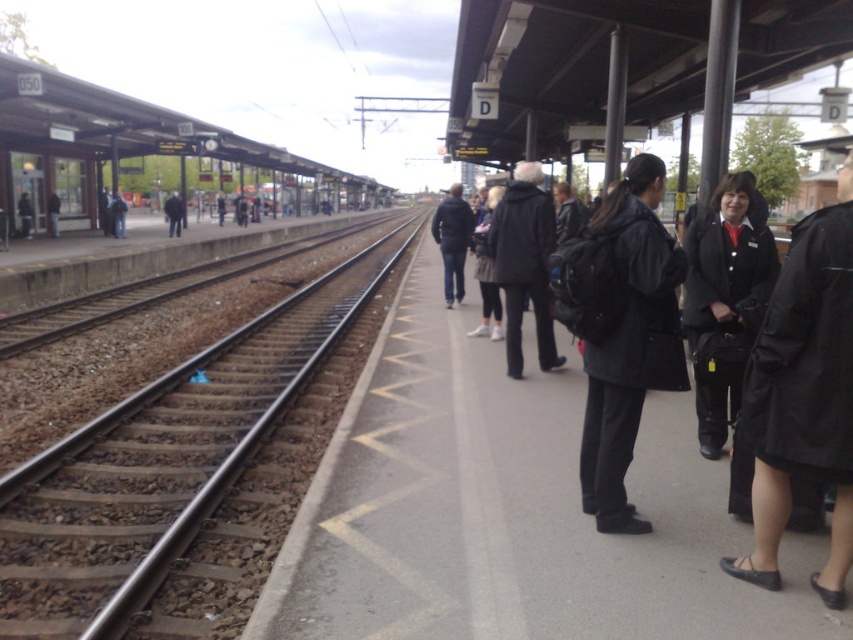
Question: Observing the image, what is the correct spatial positioning of black matte coat at right in reference to dark gray coat at center?

Choices:
 (A) above
 (B) below

Answer: (B)

Question: Which is nearer to the black matte coat at right?

Choices:
 (A) smooth steel tracks at center
 (B) matte black backpack at center
 (C) dark gray coat at center

Answer: (B)

Question: Which point is farther to the camera?

Choices:
 (A) black matte coat at right
 (B) dark gray coat at center
 (C) matte black backpack at center

Answer: (B)

Question: Estimate the real-world distances between objects in this image. Which object is farther from the dark gray coat at center?

Choices:
 (A) black matte coat at right
 (B) smooth steel tracks at center

Answer: (B)

Question: Can you confirm if smooth steel tracks at center is positioned below matte black backpack at center?

Choices:
 (A) yes
 (B) no

Answer: (B)

Question: Considering the relative positions of smooth steel tracks at center and matte black backpack at center in the image provided, where is smooth steel tracks at center located with respect to matte black backpack at center?

Choices:
 (A) above
 (B) below

Answer: (A)